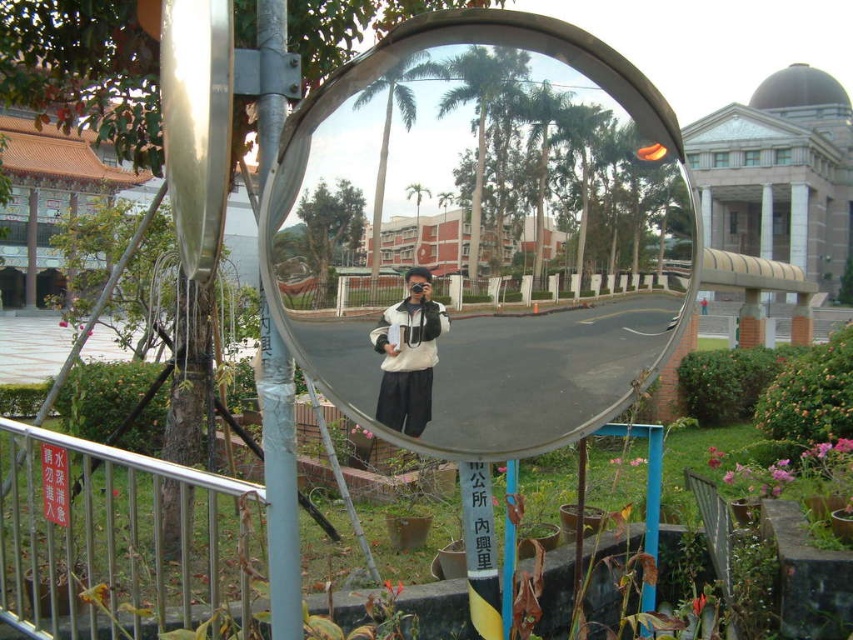
Can you confirm if clear glass mirror at center is positioned to the left of white matte jacket at center?

No, clear glass mirror at center is not to the left of white matte jacket at center.

Can you confirm if clear glass mirror at center is taller than white matte jacket at center?

Yes, clear glass mirror at center is taller than white matte jacket at center.

What do you see at coordinates (480, 234) in the screenshot?
I see `clear glass mirror at center` at bounding box center [480, 234].

I want to click on clear glass mirror at center, so (x=480, y=234).